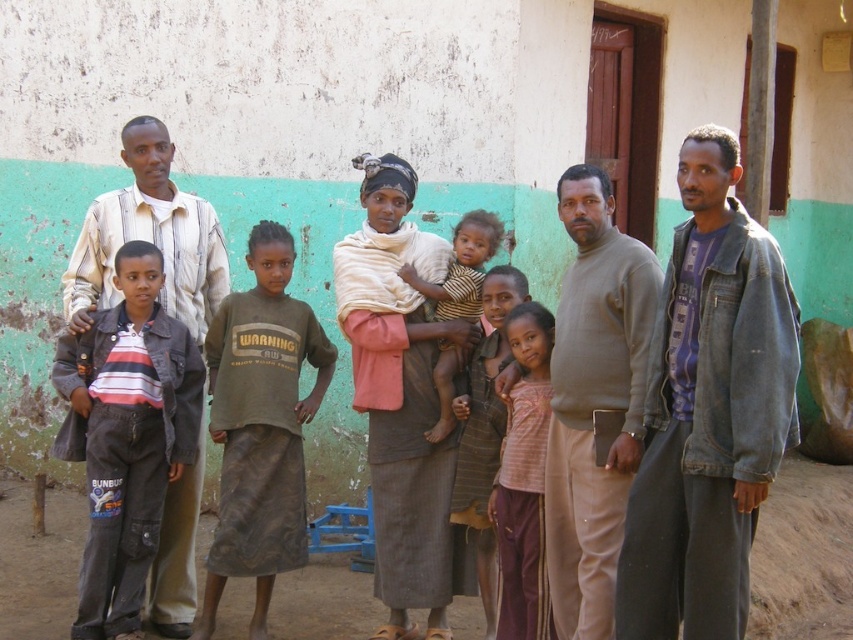
You are standing in front of the weathered building with a green and white facade. There is a point at coordinates point (756, 241). If you want to touch this point with a 4 meter long stick, can you reach it?

The distance of point (756, 241) from viewer is 4.15 meters, so the 4 meter long stick is not long enough to reach the point.

You are an interior designer analyzing the image of a weathered building with a group of people. You notice the brown textured fabric at center. Can you determine the exact coordinates where this fabric is located?

The brown textured fabric at center is located at coordinates point (399,396).